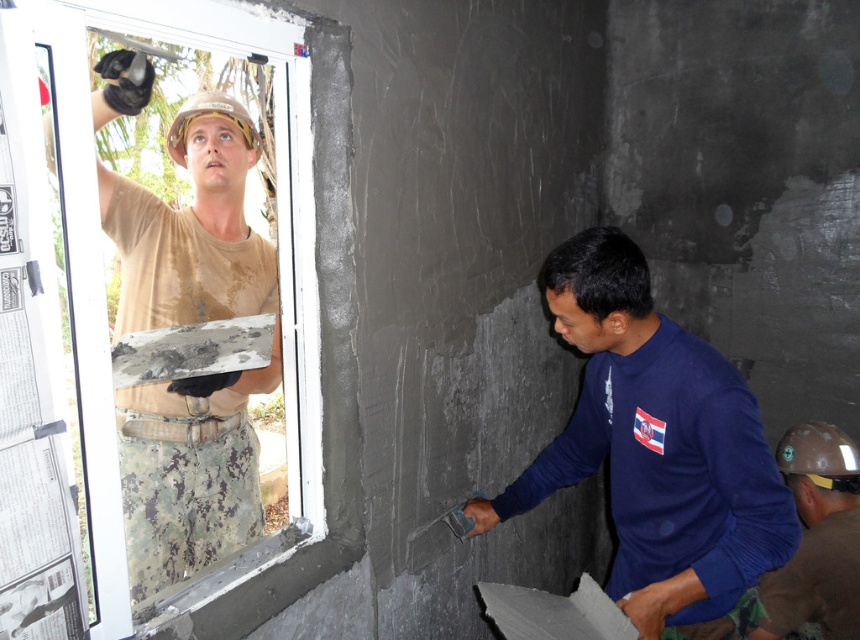
Can you confirm if white matte window at upper left is taller than matte blue shirt at lower right?

Correct, white matte window at upper left is much taller as matte blue shirt at lower right.

Between white matte window at upper left and matte blue shirt at lower right, which one is positioned higher?

Positioned higher is white matte window at upper left.

You are a GUI agent. You are given a task and a screenshot of the screen. Output one action in this format:
    pyautogui.click(x=<x>, y=<y>)
    Task: Click on the white matte window at upper left
    This screenshot has width=860, height=640.
    Given the screenshot: What is the action you would take?
    pyautogui.click(x=109, y=337)

The width and height of the screenshot is (860, 640). Identify the location of white matte window at upper left. (109, 337).

Can you confirm if white matte window at upper left is thinner than blue matte t-shirt at center?

Yes, white matte window at upper left is thinner than blue matte t-shirt at center.

Describe the element at coordinates (109, 337) in the screenshot. I see `white matte window at upper left` at that location.

Does point (234, 17) lie in front of point (631, 396)?

Yes, point (234, 17) is in front of point (631, 396).

Locate an element on the screen. Image resolution: width=860 pixels, height=640 pixels. white matte window at upper left is located at coordinates (109, 337).

Does blue matte t-shirt at center come in front of matte blue shirt at lower right?

Yes, blue matte t-shirt at center is closer to the viewer.

Is point (648, 336) positioned before point (754, 636)?

Yes, point (648, 336) is closer to viewer.

Locate an element on the screen. blue matte t-shirt at center is located at coordinates (656, 451).